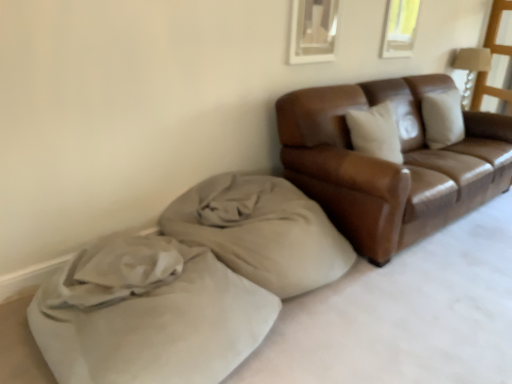
Describe the element at coordinates (497, 63) in the screenshot. I see `transparent plastic window screen at upper right` at that location.

Describe the element at coordinates (390, 164) in the screenshot. I see `brown leather couch at right` at that location.

Identify the location of transparent plastic window screen at upper right. 497,63.

Which is closer, (177,345) or (413,114)?

Point (177,345) is closer to the camera than point (413,114).

Consider the image. Is beige suede bean bag at lower left facing away from brown leather couch at right?

No, beige suede bean bag at lower left is not facing the opposite direction of brown leather couch at right.

Can you confirm if beige suede bean bag at lower left is wider than brown leather couch at right?

Yes.

Is beige suede bean bag at lower left not close to brown leather couch at right?

That's not correct — beige suede bean bag at lower left is a little close to brown leather couch at right.

Can you confirm if transparent plastic window screen at upper right is thinner than matte brown wooden lamp at upper right?

Yes.

Is the depth of transparent plastic window screen at upper right less than that of matte brown wooden lamp at upper right?

Yes, transparent plastic window screen at upper right is closer to the camera.

Is transparent plastic window screen at upper right taller than matte brown wooden lamp at upper right?

Yes.

Between matte brown wooden lamp at upper right and brown leather couch at right, which one appears on the left side from the viewer's perspective?

From the viewer's perspective, brown leather couch at right appears more on the left side.

In the scene shown: Which object is closer to the camera, matte brown wooden lamp at upper right or brown leather couch at right?

brown leather couch at right.

Is matte brown wooden lamp at upper right bigger than brown leather couch at right?

No, matte brown wooden lamp at upper right is not bigger than brown leather couch at right.

From the picture: In terms of width, does matte brown wooden lamp at upper right look wider or thinner when compared to brown leather couch at right?

matte brown wooden lamp at upper right is thinner than brown leather couch at right.

Considering the positions of point (408, 184) and point (479, 100), is point (408, 184) closer or farther from the camera than point (479, 100)?

Point (408, 184) appears to be closer to the viewer than point (479, 100).

Can transparent plastic window screen at upper right be found inside brown leather couch at right?

No, transparent plastic window screen at upper right is located outside of brown leather couch at right.

From the image's perspective, is brown leather couch at right located beneath transparent plastic window screen at upper right?

Correct, brown leather couch at right appears lower than transparent plastic window screen at upper right in the image.

Between brown leather couch at right and transparent plastic window screen at upper right, which one appears on the left side from the viewer's perspective?

A: Positioned to the left is brown leather couch at right.

From the image's perspective, is matte brown wooden lamp at upper right located above beige fabric cushion at lower left?

Yes, from the image's perspective, matte brown wooden lamp at upper right is over beige fabric cushion at lower left.

Looking at this image, considering the sizes of objects matte brown wooden lamp at upper right and beige fabric cushion at lower left in the image provided, who is shorter, matte brown wooden lamp at upper right or beige fabric cushion at lower left?

beige fabric cushion at lower left.

How far apart are matte brown wooden lamp at upper right and beige fabric cushion at lower left?

matte brown wooden lamp at upper right is 9.67 feet from beige fabric cushion at lower left.

Could you tell me if matte brown wooden lamp at upper right is facing beige fabric cushion at lower left?

No.

From the picture: What's the angular difference between beige fabric cushion at lower left and brown leather couch at right's facing directions?

0.000239 degrees separate the facing orientations of beige fabric cushion at lower left and brown leather couch at right.

Considering the sizes of objects beige fabric cushion at lower left and brown leather couch at right in the image provided, who is wider, beige fabric cushion at lower left or brown leather couch at right?

brown leather couch at right.

Considering the positions of points (244, 201) and (344, 201), is point (244, 201) farther from camera compared to point (344, 201)?

Yes, it is behind point (344, 201).

At what (x,y) coordinates should I click in order to perform the action: click on studio couch located above the beige fabric cushion at lower left (from a real-world perspective). Please return your answer as a coordinate pair (x, y). The height and width of the screenshot is (384, 512). Looking at the image, I should click on (390, 164).

Between matte brown wooden lamp at upper right and beige suede bean bag at lower left, which one has larger size?

beige suede bean bag at lower left.

Does point (471, 79) appear closer or farther from the camera than point (176, 325)?

Point (471, 79).

Which of these two, matte brown wooden lamp at upper right or beige suede bean bag at lower left, is wider?

beige suede bean bag at lower left is wider.

Where is `studio couch above the beige suede bean bag at lower left (from a real-world perspective)`? studio couch above the beige suede bean bag at lower left (from a real-world perspective) is located at coordinates (390, 164).

Identify the location of lamp located behind the transparent plastic window screen at upper right. Image resolution: width=512 pixels, height=384 pixels. (471, 67).

Looking at the image, which one is located closer to beige suede bean bag at lower left, brown leather couch at right or beige fabric cushion at lower left?

The object closer to beige suede bean bag at lower left is beige fabric cushion at lower left.

Estimate the real-world distances between objects in this image. Which object is closer to transparent plastic window screen at upper right, beige fabric cushion at lower left or beige suede bean bag at lower left?

The object closer to transparent plastic window screen at upper right is beige fabric cushion at lower left.

Which object lies nearer to the anchor point matte brown wooden lamp at upper right, beige fabric cushion at lower left or beige suede bean bag at lower left?

Based on the image, beige fabric cushion at lower left appears to be nearer to matte brown wooden lamp at upper right.

Which object lies nearer to the anchor point beige fabric cushion at lower left, beige suede bean bag at lower left or transparent plastic window screen at upper right?

Among the two, beige suede bean bag at lower left is located nearer to beige fabric cushion at lower left.

Based on their spatial positions, is beige suede bean bag at lower left or transparent plastic window screen at upper right further from matte brown wooden lamp at upper right?

beige suede bean bag at lower left.

Estimate the real-world distances between objects in this image. Which object is further from beige fabric cushion at lower left, transparent plastic window screen at upper right or beige suede bean bag at lower left?

The object further to beige fabric cushion at lower left is transparent plastic window screen at upper right.

Which object lies nearer to the anchor point brown leather couch at right, matte brown wooden lamp at upper right or beige suede bean bag at lower left?

The object closer to brown leather couch at right is beige suede bean bag at lower left.

Estimate the real-world distances between objects in this image. Which object is further from matte brown wooden lamp at upper right, transparent plastic window screen at upper right or brown leather couch at right?

brown leather couch at right is further to matte brown wooden lamp at upper right.

Identify the location of window screen between brown leather couch at right and matte brown wooden lamp at upper right from front to back. The width and height of the screenshot is (512, 384). (497, 63).

Where is `material located between beige suede bean bag at lower left and transparent plastic window screen at upper right in the left-right direction`? material located between beige suede bean bag at lower left and transparent plastic window screen at upper right in the left-right direction is located at coordinates (261, 231).

At what (x,y) coordinates should I click in order to perform the action: click on studio couch between beige fabric cushion at lower left and transparent plastic window screen at upper right. Please return your answer as a coordinate pair (x, y). The height and width of the screenshot is (384, 512). Looking at the image, I should click on (390, 164).

Locate an element on the screen. studio couch situated between beige suede bean bag at lower left and transparent plastic window screen at upper right from left to right is located at coordinates (390, 164).